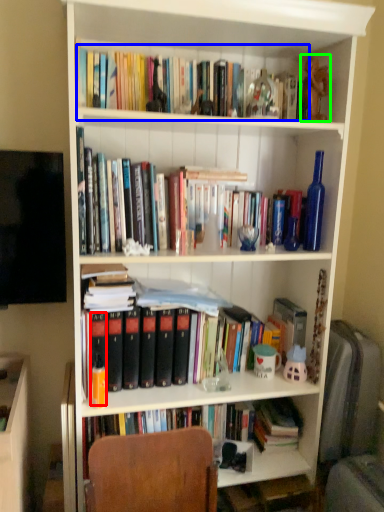
Question: Estimate the real-world distances between objects in this image. Which object is farther from paperback book (highlighted by a red box), book (highlighted by a blue box) or toy (highlighted by a green box)?

Choices:
 (A) book
 (B) toy

Answer: (B)